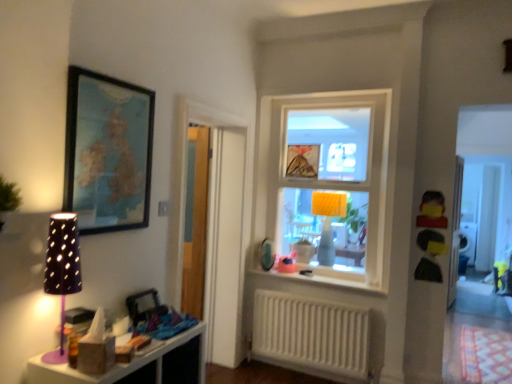
Find the location of a particular element. This screenshot has width=512, height=384. free space above white plastic radiator at lower center (from a real-world perspective) is located at coordinates (316, 294).